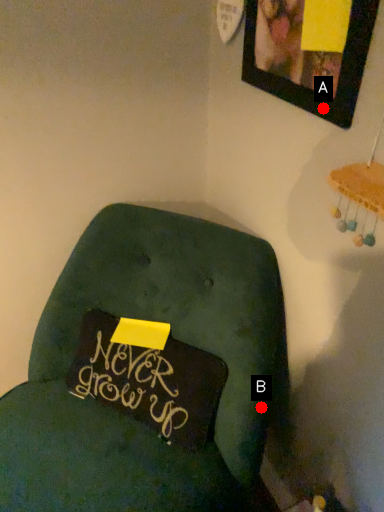
Question: Two points are circled on the image, labeled by A and B beside each circle. Which of the following is the farthest from the observer?

Choices:
 (A) A is further
 (B) B is further

Answer: (B)